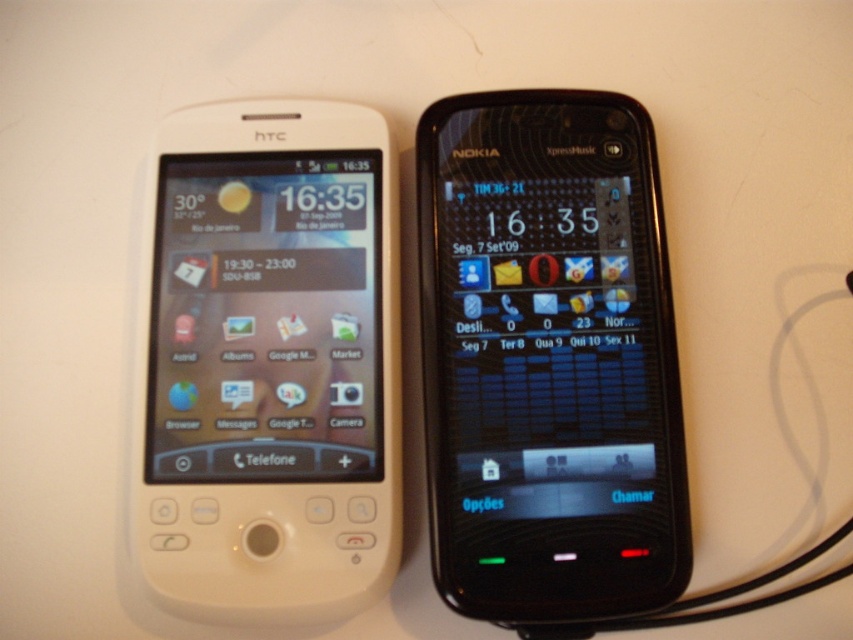
Question: In this image, where is black glossy nokia phone at center located relative to white matte htc phone at left?

Choices:
 (A) below
 (B) above

Answer: (B)

Question: Which of the following is the farthest from the observer?

Choices:
 (A) (389, 468)
 (B) (483, 545)

Answer: (A)

Question: Which of the following is the farthest from the observer?

Choices:
 (A) (357, 328)
 (B) (637, 291)

Answer: (B)

Question: In this image, where is black glossy nokia phone at center located relative to white matte htc phone at left?

Choices:
 (A) above
 (B) below

Answer: (A)

Question: Can you confirm if black glossy nokia phone at center is positioned to the right of white matte htc phone at left?

Choices:
 (A) yes
 (B) no

Answer: (A)